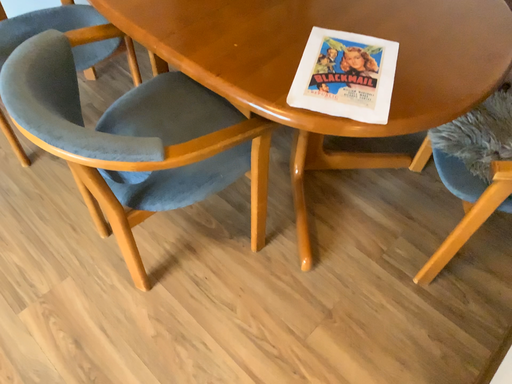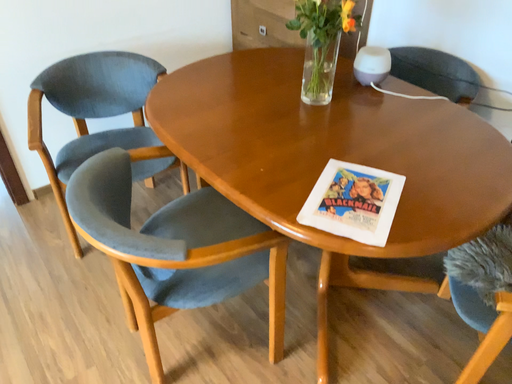
Question: How did the camera likely rotate when shooting the video?

Choices:
 (A) rotated downward
 (B) rotated upward

Answer: (B)